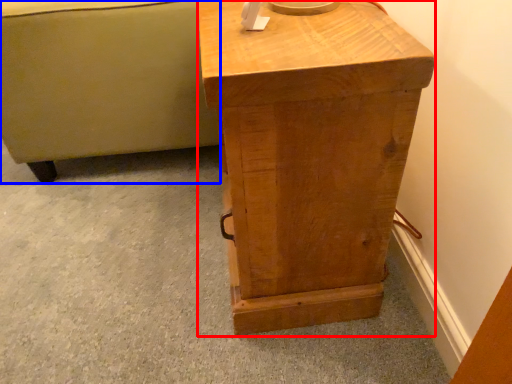
Question: Which point is closer to the camera, nightstand (highlighted by a red box) or furniture (highlighted by a blue box)?

Choices:
 (A) nightstand
 (B) furniture

Answer: (A)